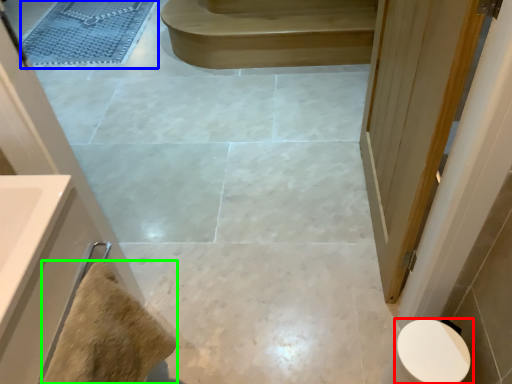
Question: Which object is the closest to the toilet (highlighted by a red box)? Choose among these: bath mat (highlighted by a blue box) or material (highlighted by a green box).

Choices:
 (A) bath mat
 (B) material

Answer: (B)